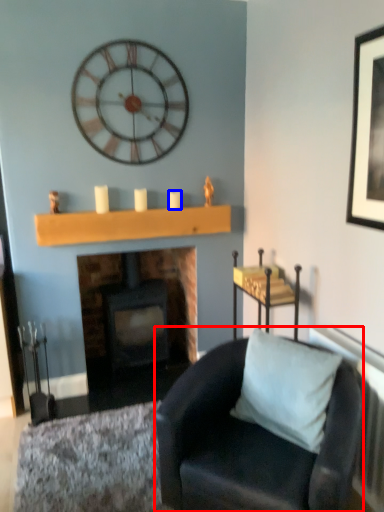
Question: Among these objects, which one is nearest to the camera, chair (highlighted by a red box) or candle (highlighted by a blue box)?

Choices:
 (A) chair
 (B) candle

Answer: (A)